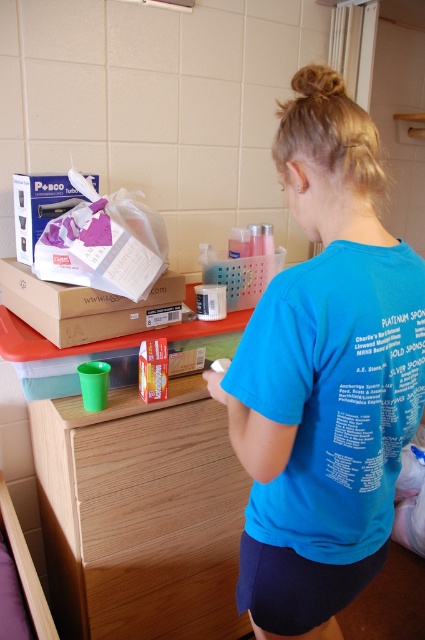
Can you confirm if blue cotton shirt at center is taller than purple matte posco at upper left?

Result: Correct, blue cotton shirt at center is much taller as purple matte posco at upper left.

Between point (385, 276) and point (14, 188), which one is positioned behind?

Positioned behind is point (14, 188).

Does point (382, 528) come in front of point (28, 225)?

Yes, point (382, 528) is closer to viewer.

The image size is (425, 640). I want to click on blue cotton shirt at center, so click(x=325, y=381).

The width and height of the screenshot is (425, 640). Describe the element at coordinates (325, 381) in the screenshot. I see `blue cotton shirt at center` at that location.

Looking at this image, can you confirm if blue cotton shirt at center is wider than braided hair at upper center?

Yes.

Between point (277, 336) and point (317, 76), which one is positioned behind?

Positioned behind is point (317, 76).

Locate an element on the screen. This screenshot has height=640, width=425. blue cotton shirt at center is located at coordinates (325, 381).

Does matte cardboard box at upper left lie in front of purple matte posco at upper left?

Yes, matte cardboard box at upper left is in front of purple matte posco at upper left.

Locate an element on the screen. The height and width of the screenshot is (640, 425). matte cardboard box at upper left is located at coordinates (85, 307).

Identify the location of matte cardboard box at upper left. (85, 307).